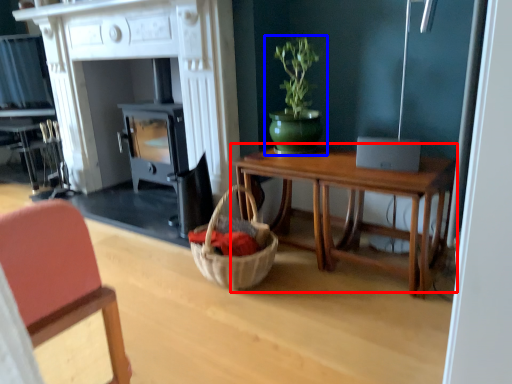
Question: Which object is closer to the camera taking this photo, table (highlighted by a red box) or houseplant (highlighted by a blue box)?

Choices:
 (A) table
 (B) houseplant

Answer: (A)